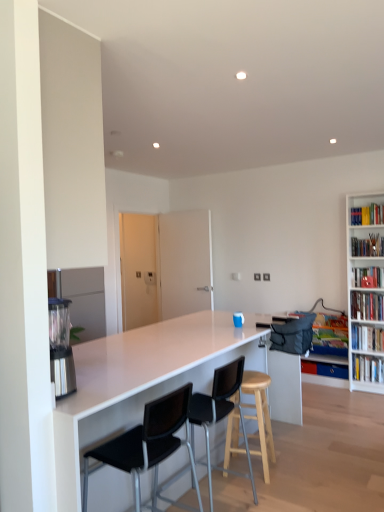
Locate an element on the screen. The width and height of the screenshot is (384, 512). vacant space to the right of stainless steel blender at left is located at coordinates [92, 390].